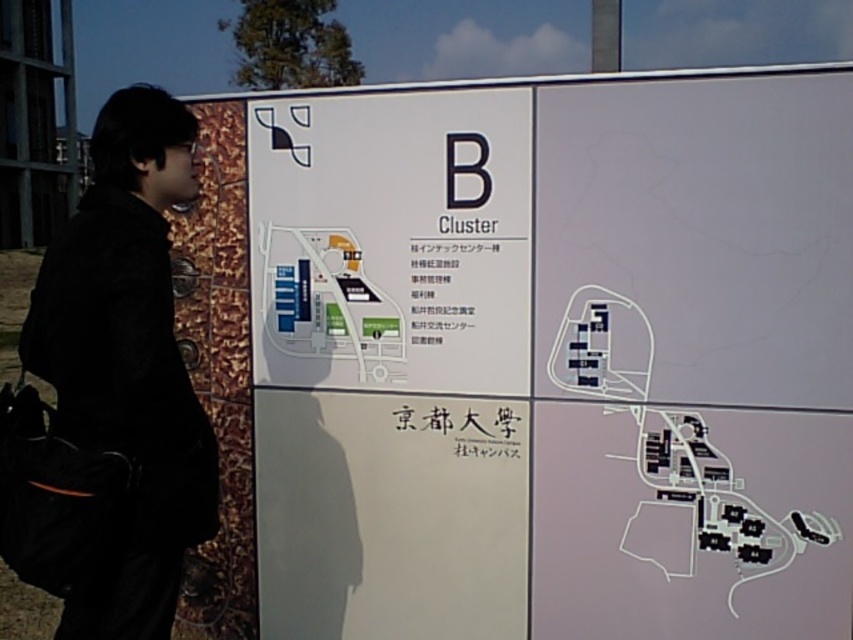
What is the exact coordinate of the white paper map at upper center on the informational board?

The white paper map at upper center is located at point (555, 358).

In the scene shown: You are a tourist holding a map and standing in front of an informational board. You want to locate the white paper map at upper center on the board. Where exactly should you look on the board?

The white paper map at upper center is located at point (555, 358) on the board.

You are a visitor at a campus and need to reach the B Cluster. You see a white paper map at upper center and a black fabric jacket at left. Which object is closer to you?

The white paper map at upper center and black fabric jacket at left are 1.13 meters apart, so both are at a distance. However, since the question asks which is closer, but the description only states their separation, the answer should clarify that without specific positioning, we can only state their distance apart. Wait, but the Objects Description says they are 1.13 meters apart. The question is which is closer to the visitor. Hmm, perhaps the answer should state that the distance between them is 1.13m,